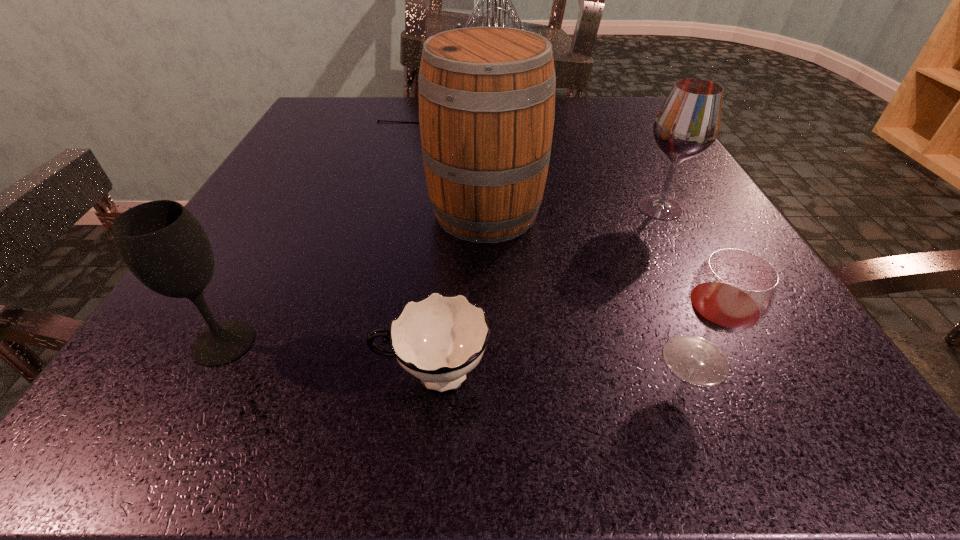
Image resolution: width=960 pixels, height=540 pixels. Identify the location of free region located on the right of the shortest wineglass. (770, 360).

I want to click on vacant area situated 0.120m on the side of the cup with the handle, so click(269, 376).

You are a GUI agent. You are given a task and a screenshot of the screen. Output one action in this format:
    pyautogui.click(x=<x>, y=<y>)
    Task: Click on the vacant space located 0.160m on the side of the cup with the handle
    
    Given the screenshot: What is the action you would take?
    pyautogui.click(x=232, y=376)

Locate an element on the screen. This screenshot has height=540, width=960. vacant position located on the side of the cup with the handle is located at coordinates (206, 376).

Identify the location of object that is at the far edge. (495, 20).

Find the location of a particular element. This screenshot has width=960, height=540. cup that is at the near edge is located at coordinates (439, 339).

Where is `object that is at the left edge`? The height and width of the screenshot is (540, 960). object that is at the left edge is located at coordinates (165, 247).

Locate an element on the screen. This screenshot has height=540, width=960. object that is at the near left corner is located at coordinates (165, 247).

Image resolution: width=960 pixels, height=540 pixels. I want to click on object located at the near right corner, so click(733, 290).

Identify the location of vacant space at the far edge. This screenshot has width=960, height=540. (573, 133).